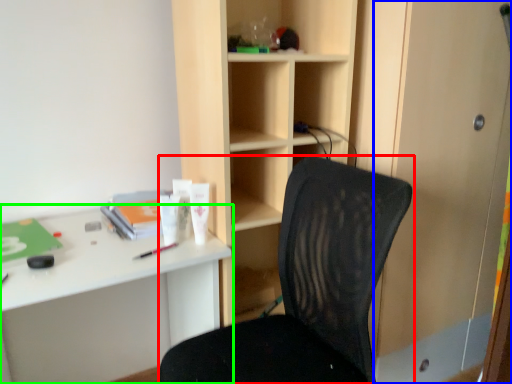
Question: Which object is the farthest from chair (highlighted by a red box)? Choose among these: screen door (highlighted by a blue box) or desk (highlighted by a green box).

Choices:
 (A) screen door
 (B) desk

Answer: (A)